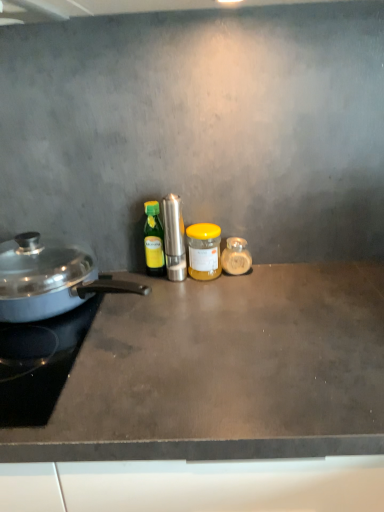
Question: Is dark gray concrete countertop at center taller or shorter than polished stainless steel grinder at center, which ranks as the 3th kitchen appliance in right-to-left order?

Choices:
 (A) tall
 (B) short

Answer: (A)

Question: From a real-world perspective, is dark gray concrete countertop at center above or below polished stainless steel grinder at center, which ranks as the 3th kitchen appliance in right-to-left order?

Choices:
 (A) above
 (B) below

Answer: (B)

Question: Considering the real-world distances, which object is closest to the green glass bottle at center, positioned as the 4th kitchen appliance in right-to-left order?

Choices:
 (A) translucent glass jar at center, acting as the 5th kitchen appliance starting from the left
 (B) yellow matte jar at center, the fourth kitchen appliance viewed from the left
 (C) polished stainless steel grinder at center, the third kitchen appliance when ordered from left to right
 (D) shiny silver pan at left, acting as the fifth kitchen appliance starting from the right
 (E) black glass gas stove at left

Answer: (C)

Question: Based on their relative distances, which object is nearer to the translucent glass jar at center, acting as the 5th kitchen appliance starting from the left?

Choices:
 (A) yellow matte jar at center, the fourth kitchen appliance viewed from the left
 (B) black glass gas stove at left
 (C) shiny silver pan at left, placed as the 1th kitchen appliance when sorted from left to right
 (D) dark gray concrete countertop at center
 (E) green glass bottle at center, marked as the second kitchen appliance in a left-to-right arrangement

Answer: (A)